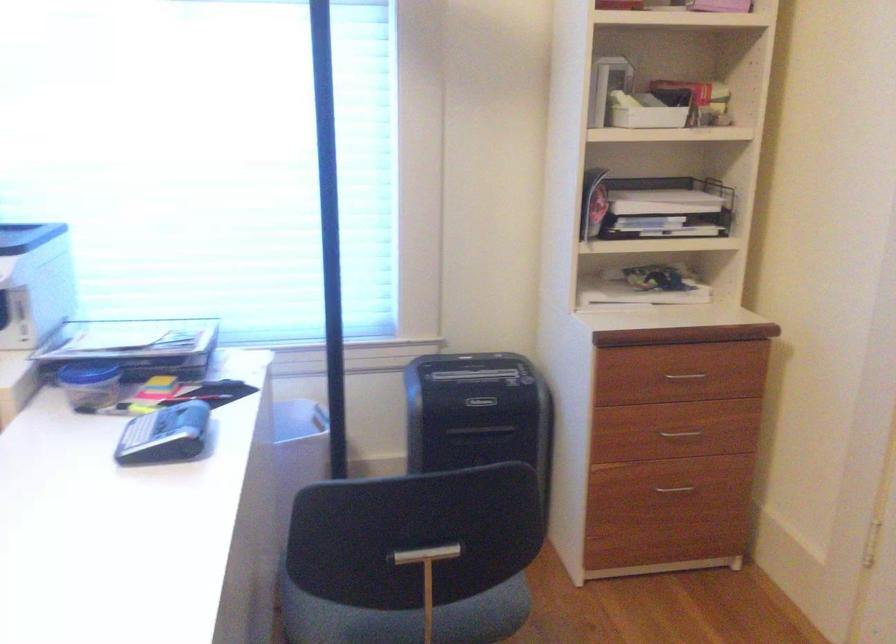
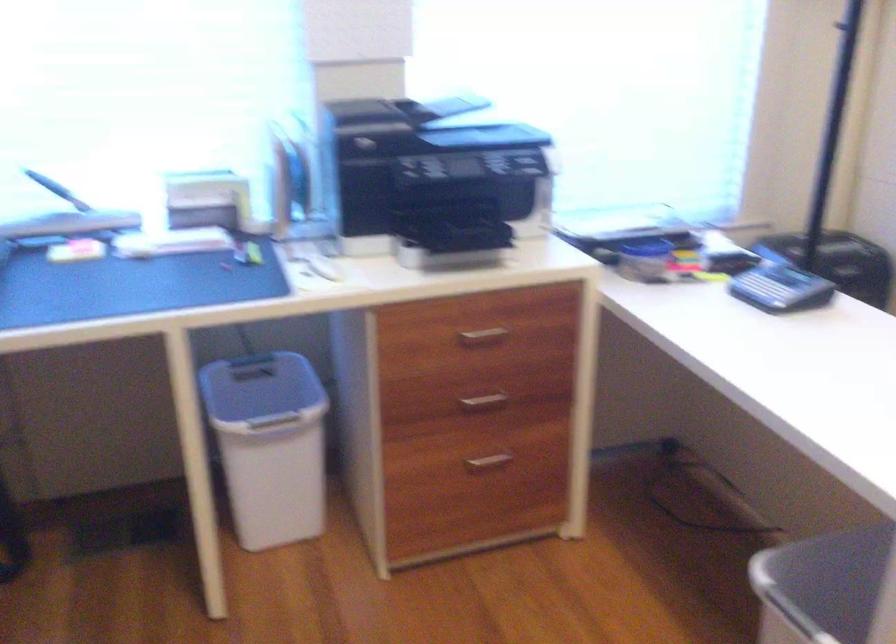
In the second image, find the point that corresponds to point 158,424 in the first image.

(763, 289)